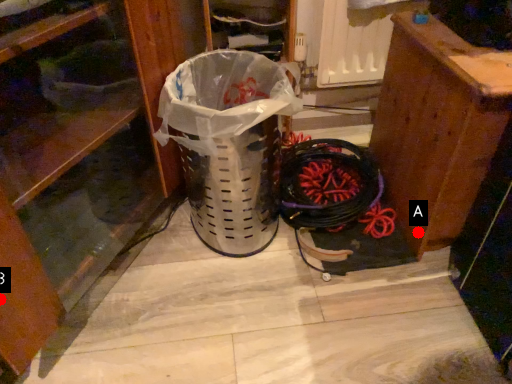
Question: Two points are circled on the image, labeled by A and B beside each circle. Among these points, which one is farthest from the camera?

Choices:
 (A) A is further
 (B) B is further

Answer: (A)